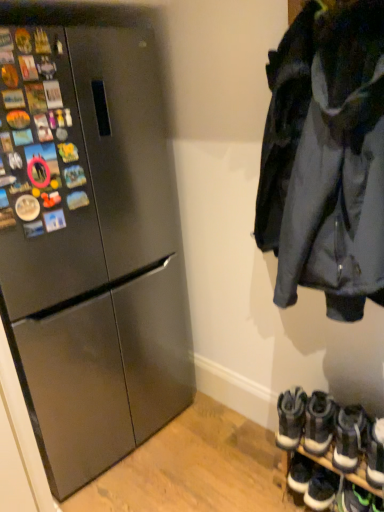
Question: Can you confirm if green suede sneakers at lower right, placed as the sixth footwear when sorted from left to right, is thinner than white suede sneakers at lower right, which is the first footwear in right-to-left order?

Choices:
 (A) no
 (B) yes

Answer: (B)

Question: Is green suede sneakers at lower right, placed as the 2th footwear when sorted from right to left, placed right next to white suede sneakers at lower right, positioned as the seventh footwear in left-to-right order?

Choices:
 (A) yes
 (B) no

Answer: (B)

Question: Considering the relative sizes of green suede sneakers at lower right, placed as the sixth footwear when sorted from left to right, and white suede sneakers at lower right, which is the first footwear in right-to-left order, in the image provided, is green suede sneakers at lower right, placed as the sixth footwear when sorted from left to right, taller than white suede sneakers at lower right, which is the first footwear in right-to-left order,?

Choices:
 (A) no
 (B) yes

Answer: (A)

Question: Is the depth of green suede sneakers at lower right, placed as the 2th footwear when sorted from right to left, less than that of white suede sneakers at lower right, positioned as the seventh footwear in left-to-right order?

Choices:
 (A) yes
 (B) no

Answer: (B)

Question: From the image's perspective, is green suede sneakers at lower right, placed as the 2th footwear when sorted from right to left, located beneath white suede sneakers at lower right, which is the first footwear in right-to-left order?

Choices:
 (A) no
 (B) yes

Answer: (B)

Question: Is green suede sneakers at lower right, placed as the 2th footwear when sorted from right to left, wider than white suede sneakers at lower right, which is the first footwear in right-to-left order?

Choices:
 (A) no
 (B) yes

Answer: (A)

Question: Is dark gray fabric jacket at upper right looking in the opposite direction of white suede sneakers at lower right, positioned as the seventh footwear in left-to-right order?

Choices:
 (A) no
 (B) yes

Answer: (A)

Question: Does dark gray fabric jacket at upper right have a greater width compared to white suede sneakers at lower right, which is the first footwear in right-to-left order?

Choices:
 (A) yes
 (B) no

Answer: (A)

Question: Does dark gray fabric jacket at upper right turn towards white suede sneakers at lower right, which is the first footwear in right-to-left order?

Choices:
 (A) no
 (B) yes

Answer: (A)

Question: From a real-world perspective, is dark gray fabric jacket at upper right positioned over white suede sneakers at lower right, which is the first footwear in right-to-left order, based on gravity?

Choices:
 (A) yes
 (B) no

Answer: (A)

Question: Can you confirm if dark gray fabric jacket at upper right is smaller than white suede sneakers at lower right, positioned as the seventh footwear in left-to-right order?

Choices:
 (A) yes
 (B) no

Answer: (B)

Question: Can you confirm if dark gray fabric jacket at upper right is shorter than white suede sneakers at lower right, which is the first footwear in right-to-left order?

Choices:
 (A) no
 (B) yes

Answer: (A)

Question: Does dark gray fabric jacket at upper right come behind white rubber sneakers at lower right, which is the fifth footwear from left to right?

Choices:
 (A) yes
 (B) no

Answer: (B)